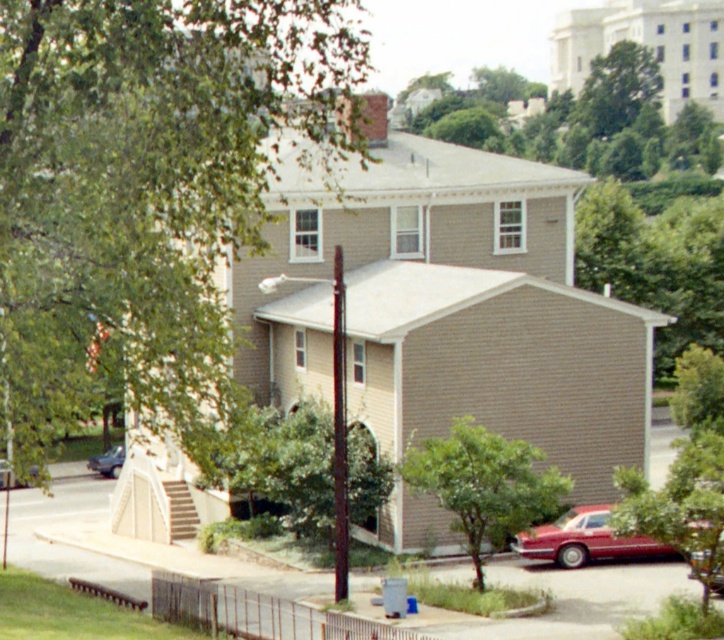
Question: Is green leafy tree at lower center behind green leafy tree at lower right?

Choices:
 (A) no
 (B) yes

Answer: (B)

Question: Which point is closer to the camera?

Choices:
 (A) metallic red car at lower right
 (B) shiny red car at lower right

Answer: (A)

Question: Can you confirm if green leafy tree at lower center is positioned above shiny silver sedan at lower left?

Choices:
 (A) yes
 (B) no

Answer: (B)

Question: Among these objects, which one is nearest to the camera?

Choices:
 (A) shiny silver sedan at lower left
 (B) green leafy tree at upper left

Answer: (B)

Question: Can you confirm if green leafy tree at upper left is positioned above shiny red car at lower right?

Choices:
 (A) no
 (B) yes

Answer: (B)

Question: Which object appears farthest from the camera in this image?

Choices:
 (A) green leafy tree at lower center
 (B) green leafy tree at upper left
 (C) shiny red car at lower right
 (D) metallic red car at lower right

Answer: (C)